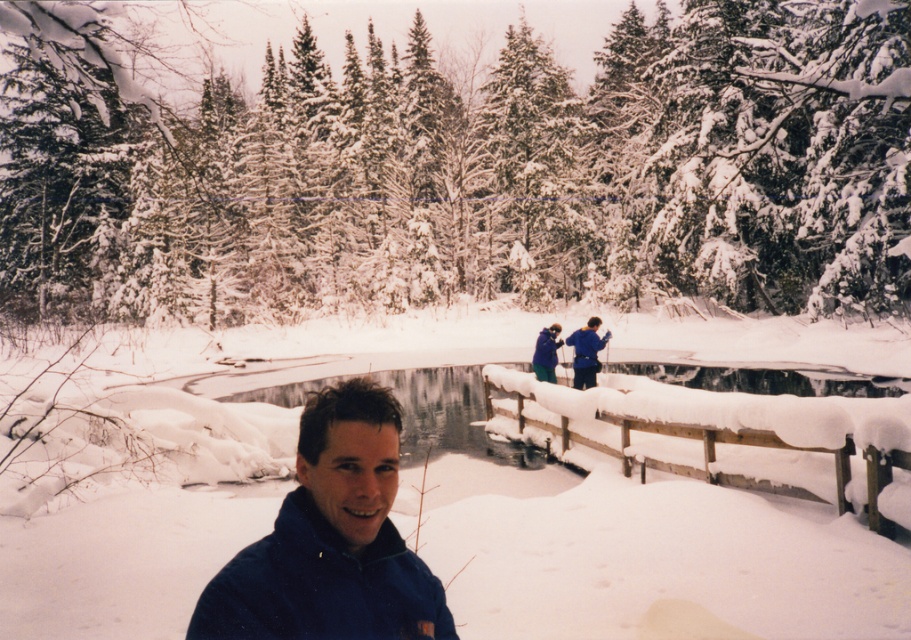
Question: Is blue fleece jacket at upper center wider than blue fleece jacket at center?

Choices:
 (A) no
 (B) yes

Answer: (B)

Question: Estimate the real-world distances between objects in this image. Which object is farther from the blue fleece jacket at center?

Choices:
 (A) blue fleece jacket at upper center
 (B) blue fleece jacket at lower left

Answer: (B)

Question: Is blue fleece jacket at lower left to the right of blue fleece jacket at upper center from the viewer's perspective?

Choices:
 (A) yes
 (B) no

Answer: (B)

Question: Among these objects, which one is nearest to the camera?

Choices:
 (A) blue fleece jacket at lower left
 (B) blue fleece jacket at center
 (C) blue fleece jacket at upper center

Answer: (A)

Question: Estimate the real-world distances between objects in this image. Which object is farther from the blue fleece jacket at lower left?

Choices:
 (A) blue fleece jacket at upper center
 (B) blue fleece jacket at center

Answer: (B)

Question: Where is blue fleece jacket at upper center located in relation to blue fleece jacket at center in the image?

Choices:
 (A) right
 (B) left

Answer: (A)